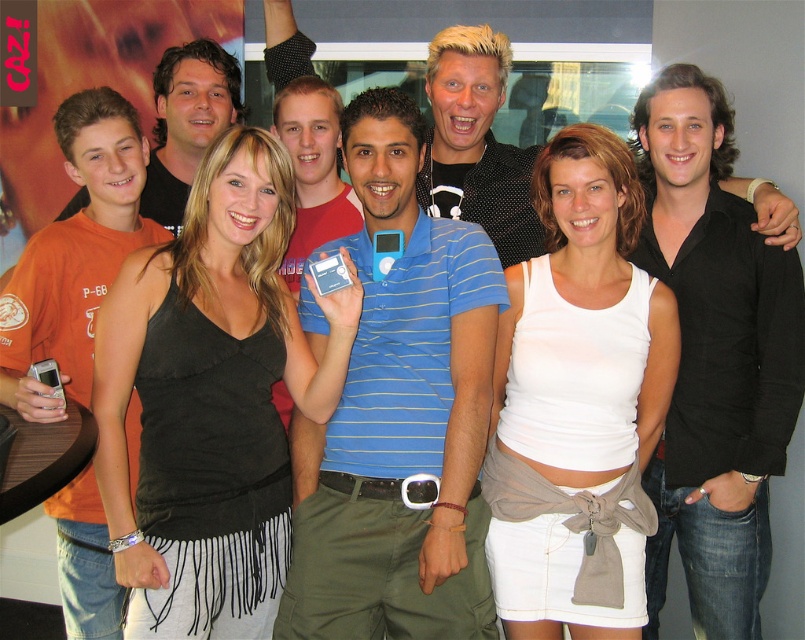
Question: Which of the following is the farthest from the observer?

Choices:
 (A) (122, 131)
 (B) (118, 484)
 (C) (560, 394)

Answer: (A)

Question: Is orange cotton t-shirt at left further to camera compared to shiny black jacket at center?

Choices:
 (A) yes
 (B) no

Answer: (B)

Question: Which object is positioned closest to the black fabric tank top at center?

Choices:
 (A) orange cotton t-shirt at left
 (B) blue striped polo shirt at center
 (C) black smooth shirt at center
 (D) white cotton tank top at center

Answer: (B)

Question: Does orange cotton t-shirt at left appear on the left side of shiny black jacket at center?

Choices:
 (A) yes
 (B) no

Answer: (A)

Question: Among these points, which one is nearest to the camera?

Choices:
 (A) (242, 138)
 (B) (440, 81)

Answer: (A)

Question: Does blue striped polo shirt at center appear under matte black shirt at upper left?

Choices:
 (A) no
 (B) yes

Answer: (B)